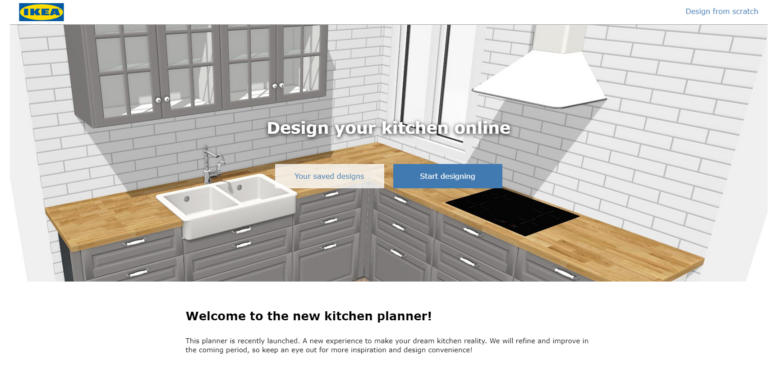
Identify the location of countertop to the left of sink. (124, 220).